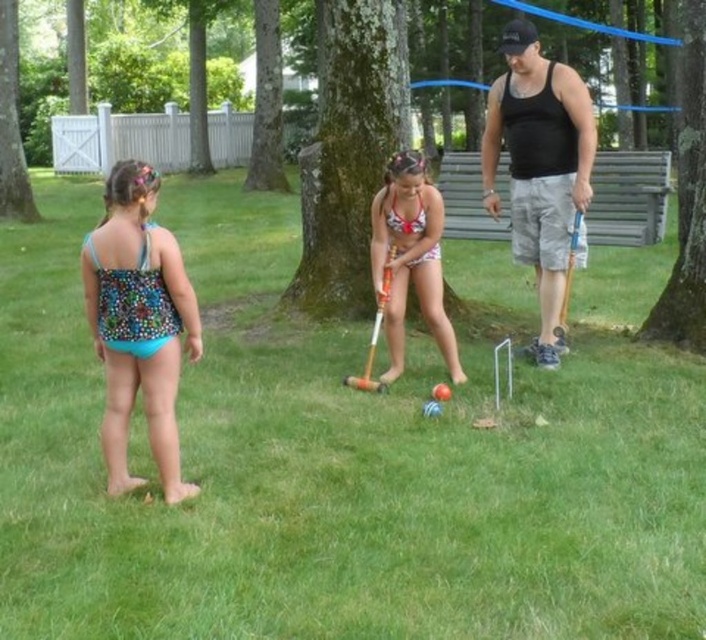
Question: Which is nearer to the green grass at center?

Choices:
 (A) white polka dot swimsuit at center
 (B) black tank top at right

Answer: (A)

Question: Does green grass at center have a larger size compared to white polka dot swimsuit at center?

Choices:
 (A) no
 (B) yes

Answer: (B)

Question: Does printed fabric swimsuit at left have a smaller size compared to white polka dot swimsuit at center?

Choices:
 (A) yes
 (B) no

Answer: (A)

Question: Can you confirm if green grass at center is positioned to the left of white polka dot swimsuit at center?

Choices:
 (A) no
 (B) yes

Answer: (B)

Question: Which point is closer to the camera taking this photo?

Choices:
 (A) (x=28, y=618)
 (B) (x=549, y=102)

Answer: (A)

Question: Which point is farther to the camera?

Choices:
 (A) (554, 508)
 (B) (438, 289)
 (C) (542, 58)

Answer: (C)